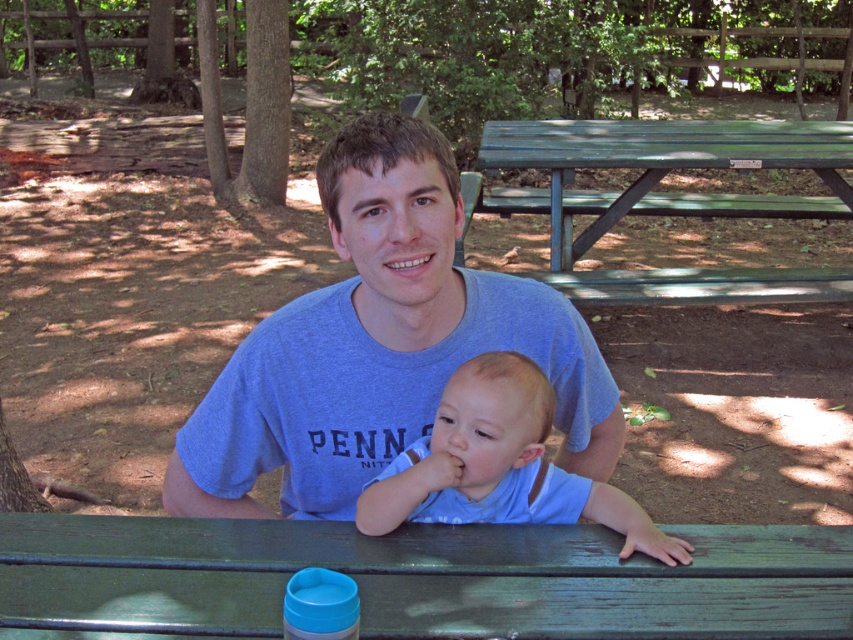
Question: Estimate the real-world distances between objects in this image. Which object is closer to the green weathered wood table at center?

Choices:
 (A) blue cotton t-shirt at center
 (B) blue cotton shirt at center

Answer: (B)

Question: Does green weathered wood table at center have a smaller size compared to green painted wood picnic table at upper center?

Choices:
 (A) yes
 (B) no

Answer: (A)

Question: Which is farther from the green weathered wood table at center?

Choices:
 (A) green painted wood picnic table at upper center
 (B) blue cotton t-shirt at center
 (C) blue cotton shirt at center

Answer: (A)

Question: Which object is farther from the camera taking this photo?

Choices:
 (A) green painted wood picnic table at upper center
 (B) green weathered wood table at center
 (C) blue cotton shirt at center

Answer: (A)

Question: Is blue cotton t-shirt at center behind blue cotton shirt at center?

Choices:
 (A) no
 (B) yes

Answer: (B)

Question: Can you confirm if green weathered wood table at center is smaller than blue cotton t-shirt at center?

Choices:
 (A) yes
 (B) no

Answer: (A)